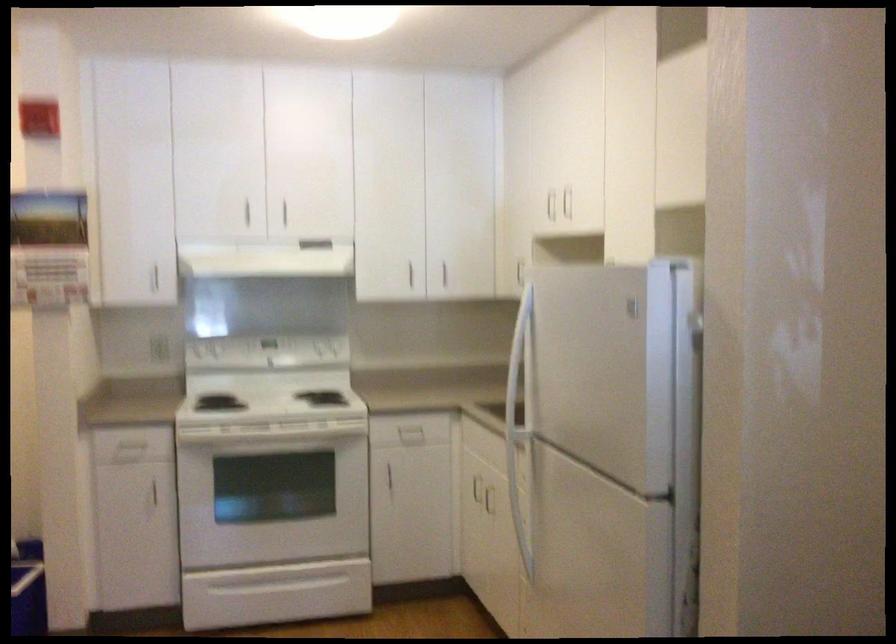
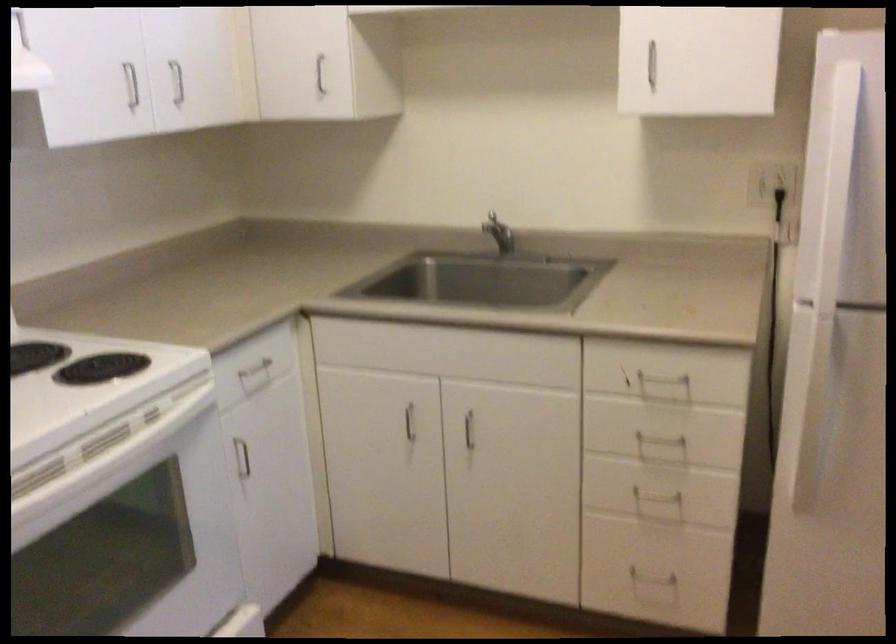
Locate, in the second image, the point that corresponds to pixel 478 486 in the first image.

(409, 422)